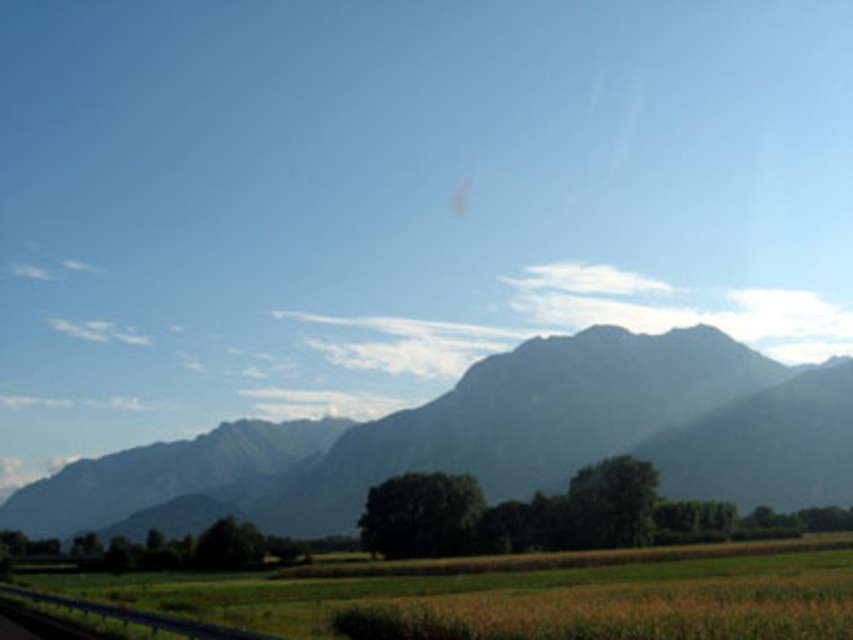
Question: Among these objects, which one is farthest from the camera?

Choices:
 (A) gray rocky mountain at center
 (B) brown grassy field at lower center

Answer: (A)

Question: Among these points, which one is farthest from the camera?

Choices:
 (A) (838, 557)
 (B) (521, 369)

Answer: (B)

Question: Considering the relative positions of gray rocky mountain at center and brown grassy field at lower center in the image provided, where is gray rocky mountain at center located with respect to brown grassy field at lower center?

Choices:
 (A) left
 (B) right

Answer: (A)

Question: Does gray rocky mountain at center appear under brown grassy field at lower center?

Choices:
 (A) no
 (B) yes

Answer: (B)

Question: Can you confirm if gray rocky mountain at center is positioned below brown grassy field at lower center?

Choices:
 (A) no
 (B) yes

Answer: (B)